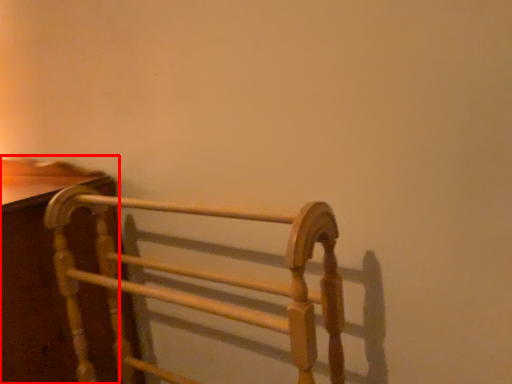
Question: Considering the relative positions of furniture (annotated by the red box) and furniture in the image provided, where is furniture (annotated by the red box) located with respect to the staircase?

Choices:
 (A) left
 (B) right

Answer: (A)